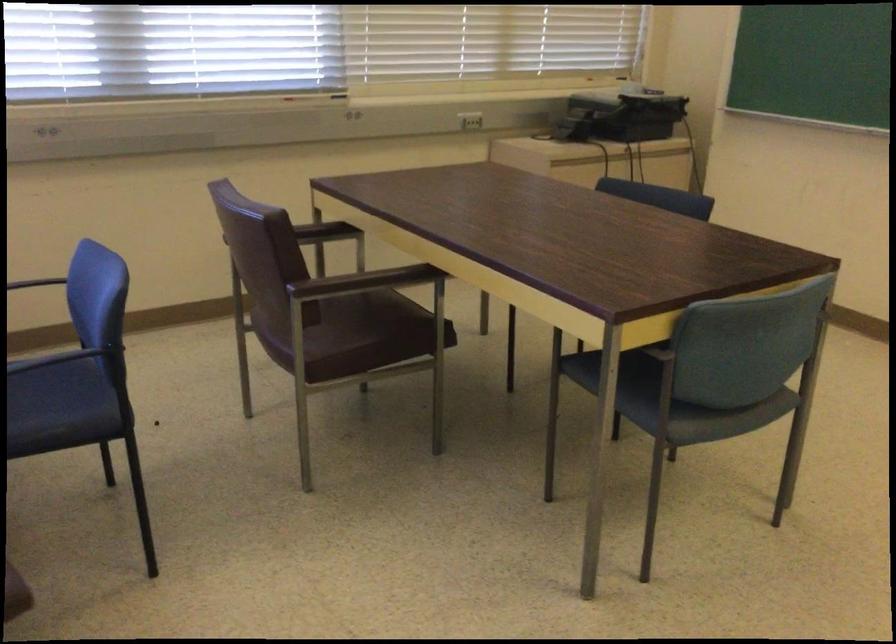
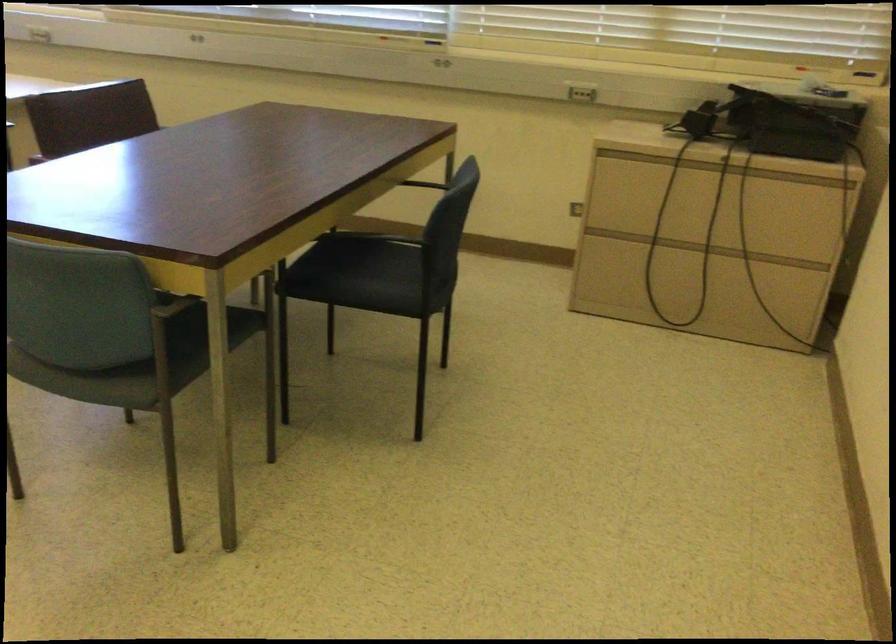
Where in the second image is the point corresponding to (x=616, y=156) from the first image?

(700, 167)